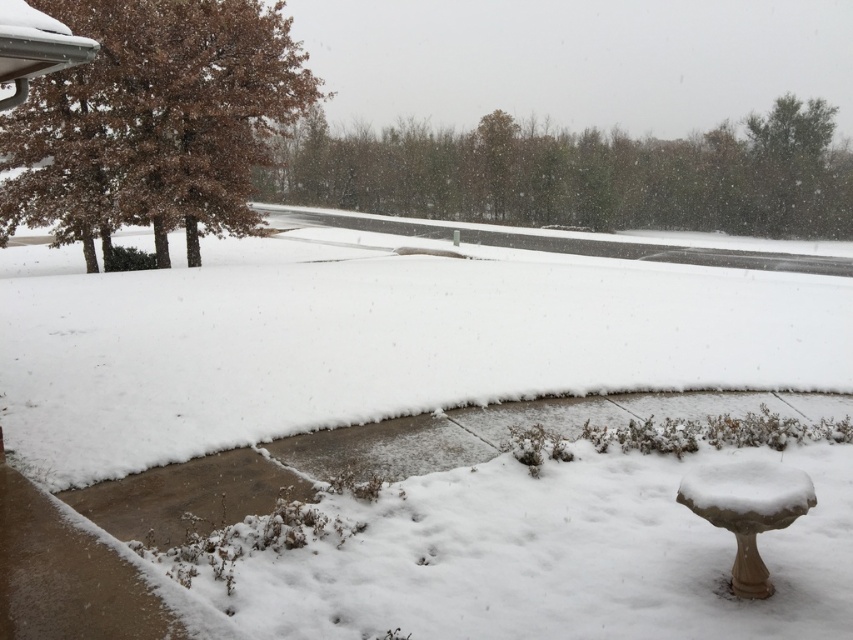
The image size is (853, 640). What do you see at coordinates (376, 339) in the screenshot?
I see `white fluffy snow at center` at bounding box center [376, 339].

Is white fluffy snow at center below white stone birdbath at lower right?

Incorrect, white fluffy snow at center is not positioned below white stone birdbath at lower right.

Is point (786, 266) closer to camera compared to point (735, 467)?

No.

This screenshot has height=640, width=853. Find the location of `white fluffy snow at center`. white fluffy snow at center is located at coordinates (376, 339).